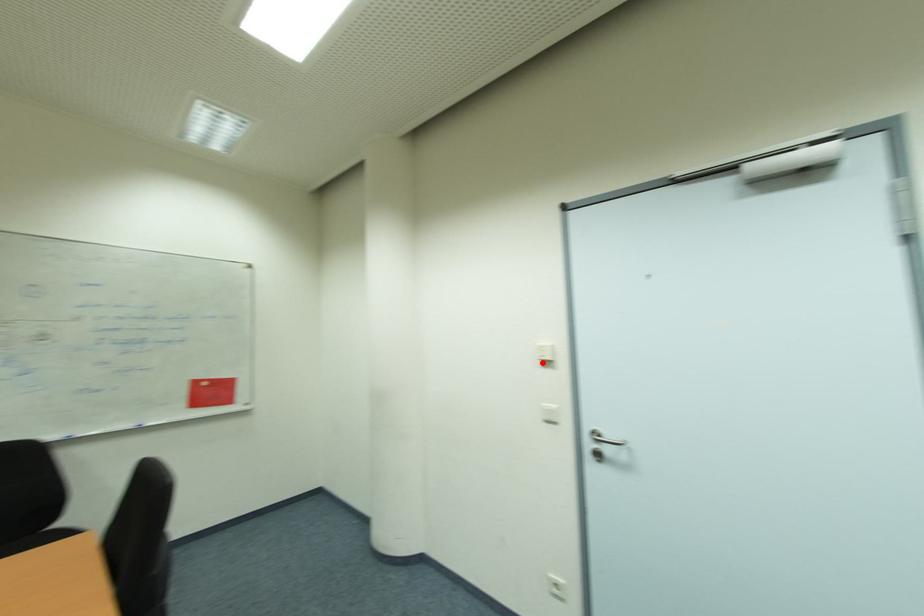
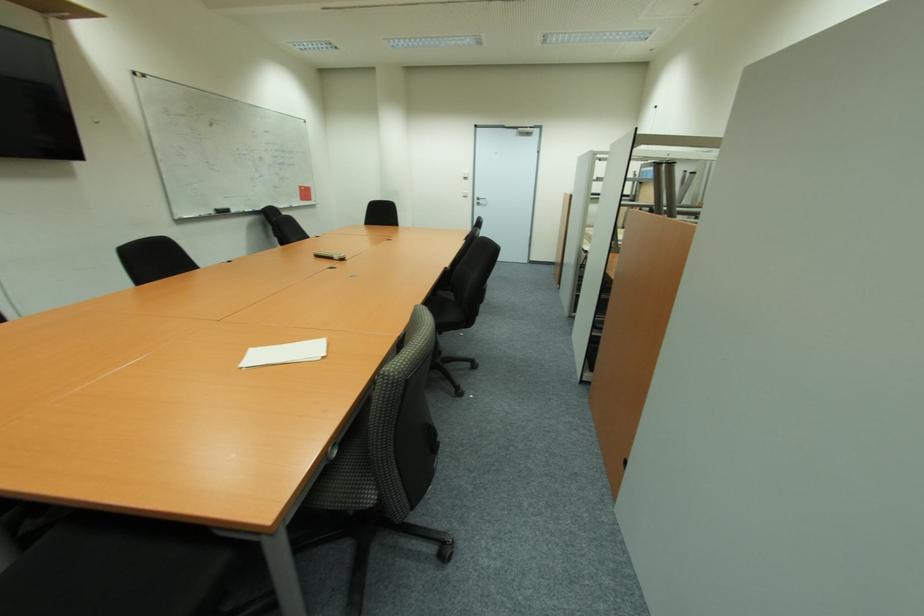
Question: I am providing you with two images of the same scene from different viewpoints. Given a red point in image1, look at the same physical point in image2. Is it:

Choices:
 (A) Closer to the viewpoint
 (B) Farther from the viewpoint

Answer: (A)